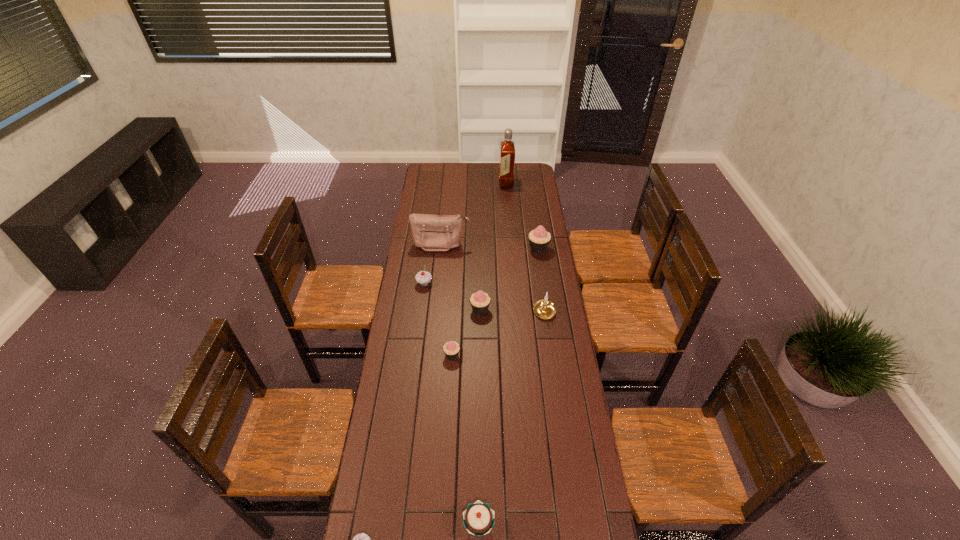
At what (x,y) coordinates should I click in order to perform the action: click on vacant space located 0.150m on the back of the leftmost pink cupcake. Please return your answer as a coordinate pair (x, y). The height and width of the screenshot is (540, 960). Looking at the image, I should click on (454, 321).

Where is `object located in the far edge section of the desktop`? The height and width of the screenshot is (540, 960). object located in the far edge section of the desktop is located at coordinates (507, 149).

You are a GUI agent. You are given a task and a screenshot of the screen. Output one action in this format:
    pyautogui.click(x=<x>, y=<y>)
    Task: Click on the shoulder bag located in the left edge section of the desktop
    The image size is (960, 540).
    Given the screenshot: What is the action you would take?
    pyautogui.click(x=430, y=232)

Locate an element on the screen. cupcake that is at the left edge is located at coordinates (423, 278).

This screenshot has width=960, height=540. Identify the location of cupcake situated at the right edge. (539, 239).

Locate an element on the screen. Image resolution: width=960 pixels, height=540 pixels. candle holder present at the right edge is located at coordinates (544, 308).

In the image, there is a desktop. Identify the location of vacant space at the far edge. This screenshot has height=540, width=960. (476, 175).

In the image, there is a desktop. Find the location of `vacant space at the left edge`. vacant space at the left edge is located at coordinates (391, 339).

The height and width of the screenshot is (540, 960). In the image, there is a desktop. In order to click on free space at the right edge in this screenshot , I will do `click(555, 413)`.

In the image, there is a desktop. Identify the location of free space at the far left corner. (443, 165).